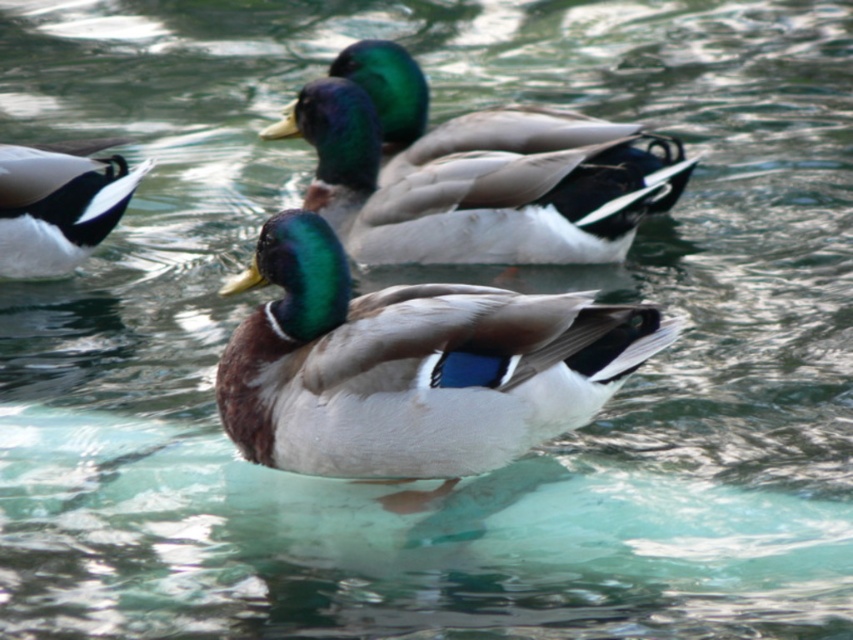
Looking at this image, which of these two, shiny brown duck at center or shiny black feathers at left, stands taller?

shiny brown duck at center

Who is shorter, shiny brown duck at center or shiny black feathers at left?

Standing shorter between the two is shiny black feathers at left.

Between point (534, 413) and point (12, 196), which one is positioned behind?

The point (12, 196) is more distant.

At what (x,y) coordinates should I click in order to perform the action: click on shiny brown duck at center. Please return your answer as a coordinate pair (x, y). Looking at the image, I should click on (410, 368).

Does point (595, 221) come in front of point (80, 163)?

Yes, point (595, 221) is in front of point (80, 163).

Can you confirm if shiny green head at center is positioned above shiny black feathers at left?

Yes, shiny green head at center is above shiny black feathers at left.

This screenshot has width=853, height=640. Describe the element at coordinates (471, 172) in the screenshot. I see `shiny green head at center` at that location.

Locate an element on the screen. This screenshot has width=853, height=640. shiny green head at center is located at coordinates (471, 172).

Where is `shiny brown duck at center`? shiny brown duck at center is located at coordinates (410, 368).